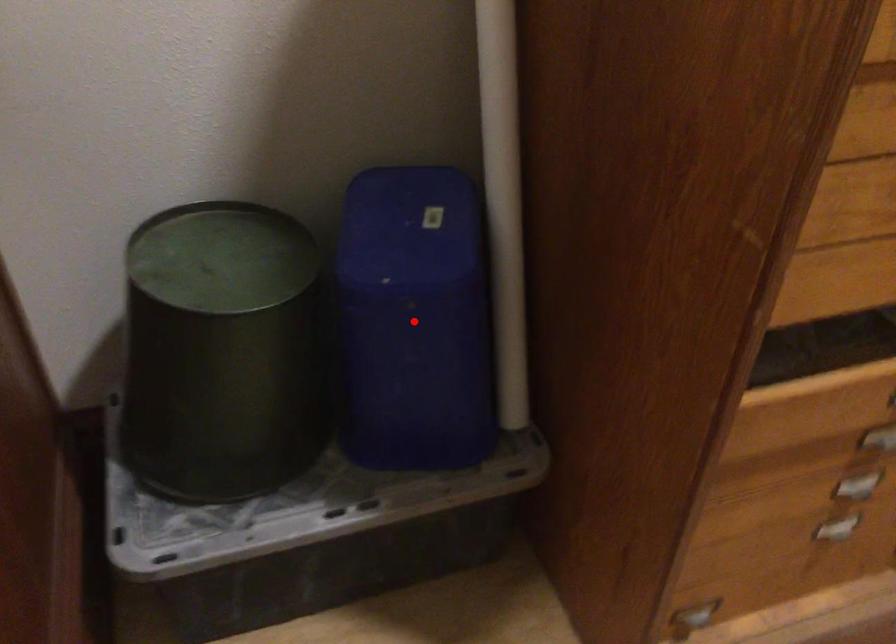
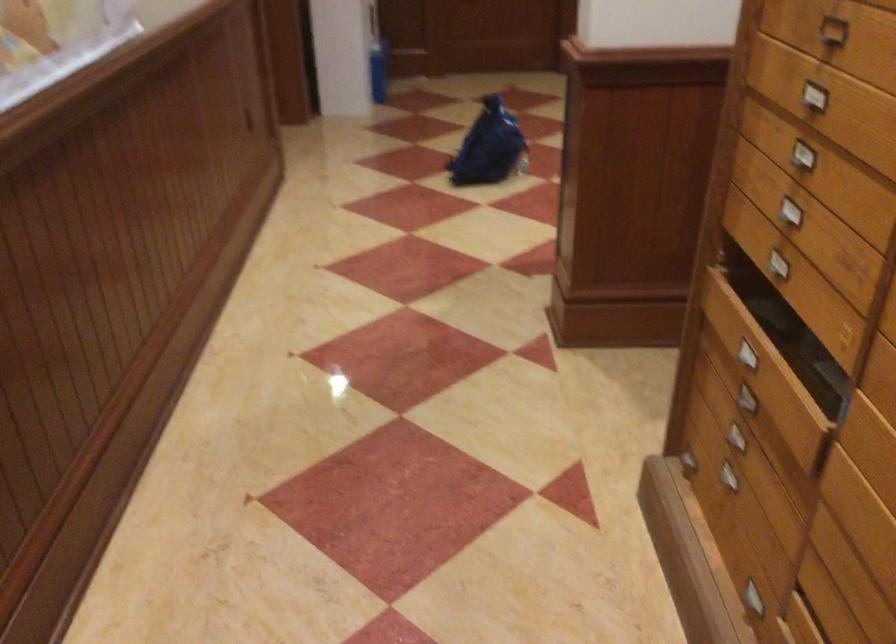
Question: I am providing you with two images of the same scene from different viewpoints. A red point is marked on the first image. Can you still see the location of the red point in image 2?

Choices:
 (A) Yes
 (B) No

Answer: (B)